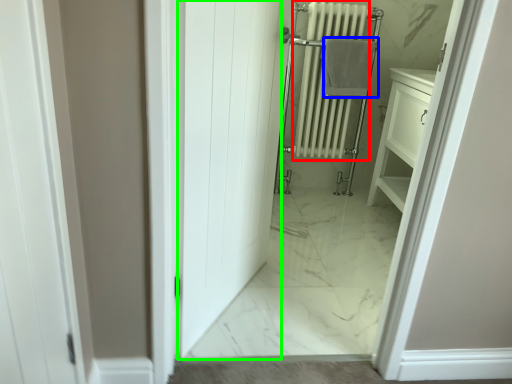
Question: Based on their relative distances, which object is farther from radiator (highlighted by a red box)? Choose from bath towel (highlighted by a blue box) and door (highlighted by a green box).

Choices:
 (A) bath towel
 (B) door

Answer: (B)